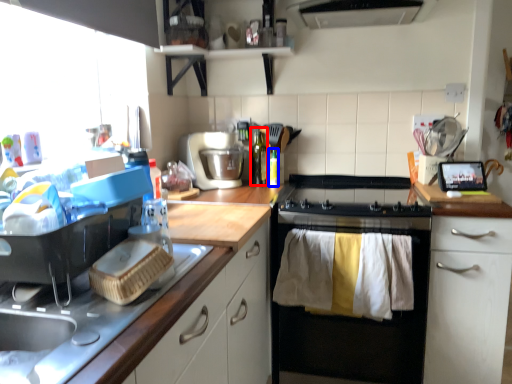
Question: Among these objects, which one is nearest to the camera, bottle (highlighted by a red box) or bottle (highlighted by a blue box)?

Choices:
 (A) bottle
 (B) bottle

Answer: (B)